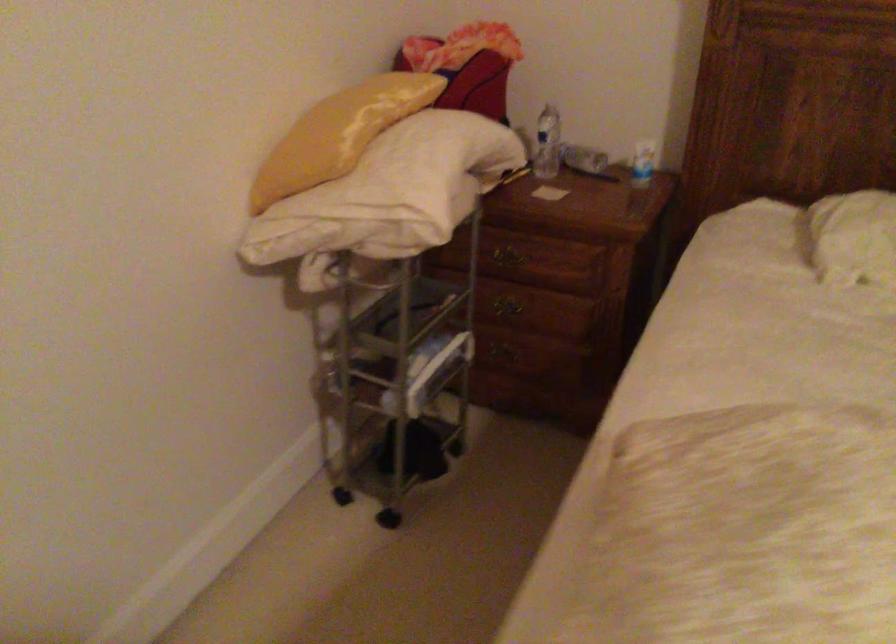
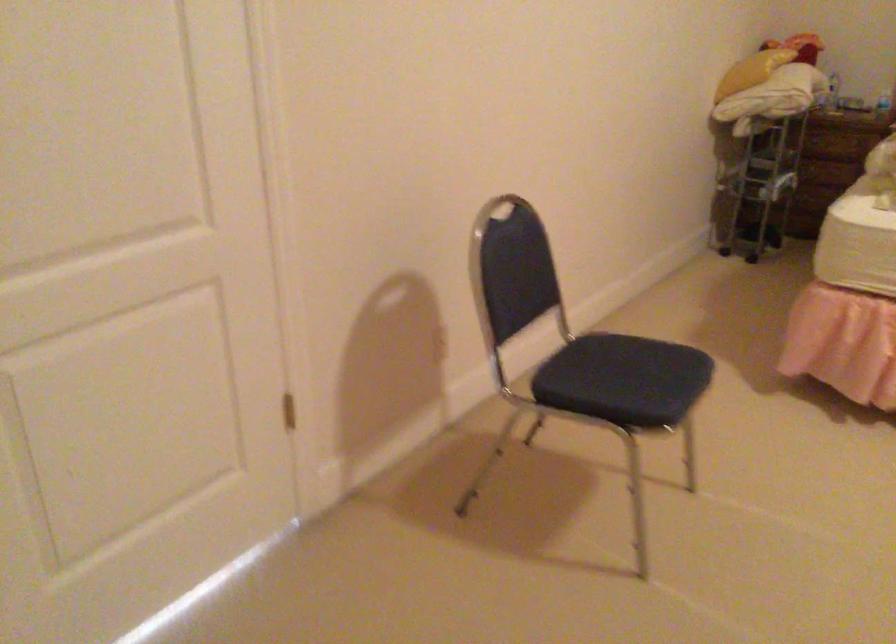
What movement of the cameraman would produce the second image?

The movement direction of the cameraman is left, backward.